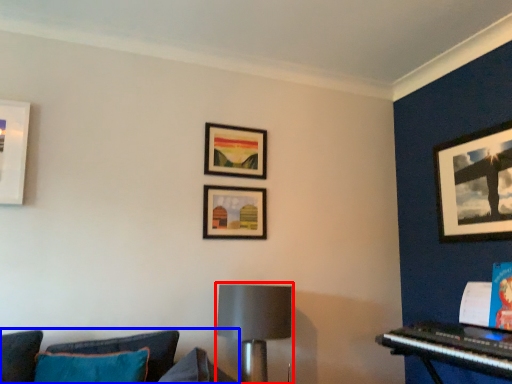
Question: Which object is further to the camera taking this photo, lamp (highlighted by a red box) or studio couch (highlighted by a blue box)?

Choices:
 (A) lamp
 (B) studio couch

Answer: (A)